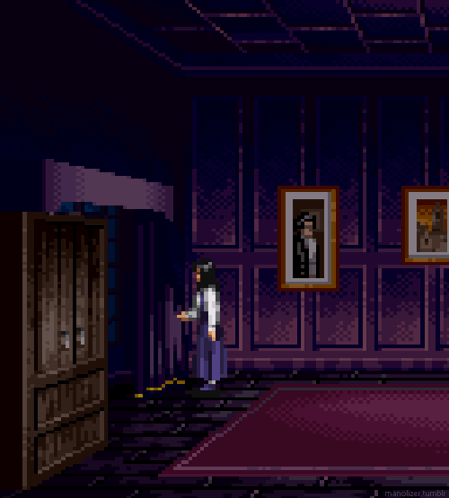
Locate an element on the screen. The image size is (449, 498). paintings is located at coordinates (312, 240), (434, 224).